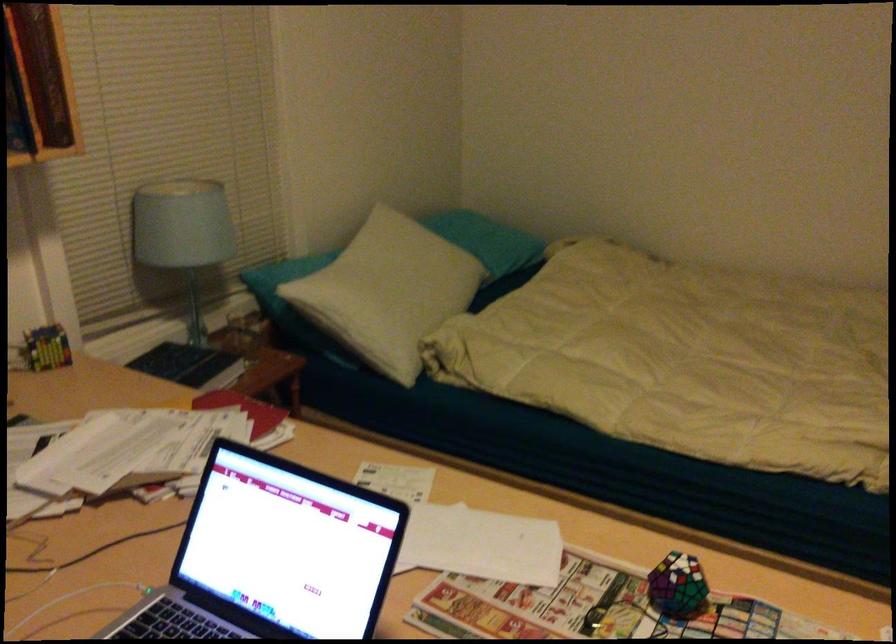
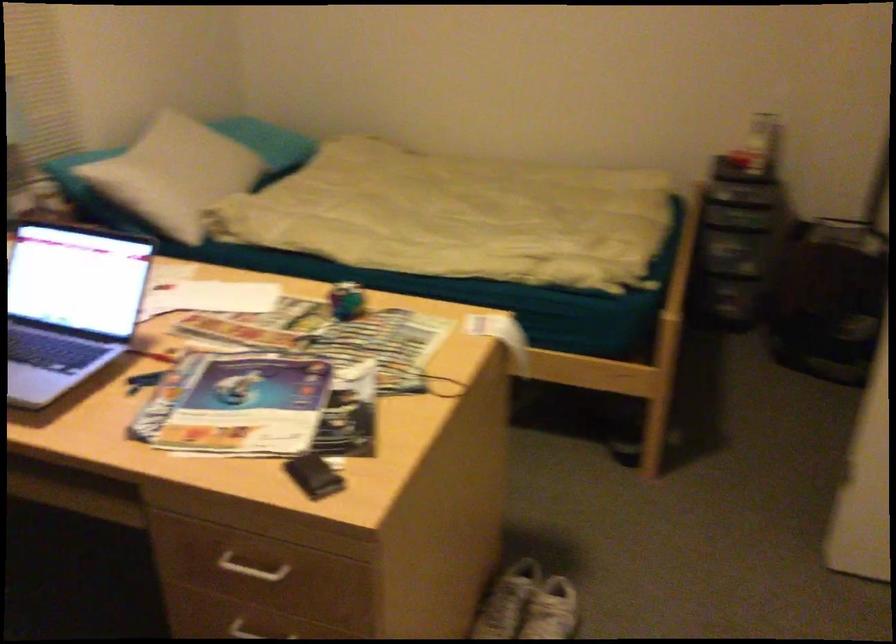
Question: The first image is from the beginning of the video and the second image is from the end. How did the camera likely rotate when shooting the video?

Choices:
 (A) Left
 (B) Right
 (C) Up
 (D) Down

Answer: (B)